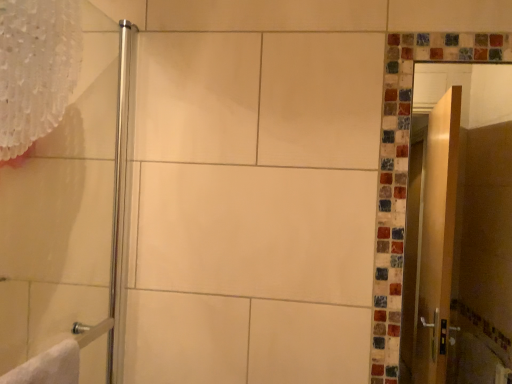
Question: Is polished chrome shower door at left facing away from wooden screen door at right?

Choices:
 (A) yes
 (B) no

Answer: (B)

Question: From a real-world perspective, is polished chrome shower door at left physically below wooden screen door at right?

Choices:
 (A) no
 (B) yes

Answer: (B)

Question: Does polished chrome shower door at left have a smaller size compared to wooden screen door at right?

Choices:
 (A) yes
 (B) no

Answer: (B)

Question: Is polished chrome shower door at left to the left of wooden screen door at right from the viewer's perspective?

Choices:
 (A) yes
 (B) no

Answer: (A)

Question: Is the depth of polished chrome shower door at left less than that of wooden screen door at right?

Choices:
 (A) yes
 (B) no

Answer: (A)

Question: From their relative heights in the image, would you say polished chrome shower door at left is taller or shorter than white lace curtain at upper left?

Choices:
 (A) short
 (B) tall

Answer: (B)

Question: Considering the relative positions of polished chrome shower door at left and white lace curtain at upper left in the image provided, is polished chrome shower door at left to the left or to the right of white lace curtain at upper left?

Choices:
 (A) left
 (B) right

Answer: (B)

Question: From a real-world perspective, is polished chrome shower door at left physically located above or below white lace curtain at upper left?

Choices:
 (A) above
 (B) below

Answer: (B)

Question: From the image's perspective, relative to white lace curtain at upper left, is polished chrome shower door at left above or below?

Choices:
 (A) below
 (B) above

Answer: (A)

Question: From a real-world perspective, is wooden screen door at right above or below polished chrome shower door at left?

Choices:
 (A) above
 (B) below

Answer: (A)

Question: Based on their sizes in the image, would you say wooden screen door at right is bigger or smaller than polished chrome shower door at left?

Choices:
 (A) small
 (B) big

Answer: (A)

Question: From the image's perspective, is wooden screen door at right positioned above or below polished chrome shower door at left?

Choices:
 (A) above
 (B) below

Answer: (B)

Question: Visually, is wooden screen door at right positioned to the left or to the right of polished chrome shower door at left?

Choices:
 (A) right
 (B) left

Answer: (A)

Question: Looking at their shapes, would you say wooden screen door at right is wider or thinner than white lace curtain at upper left?

Choices:
 (A) thin
 (B) wide

Answer: (A)

Question: In the image, is wooden screen door at right positioned in front of or behind white lace curtain at upper left?

Choices:
 (A) behind
 (B) front

Answer: (A)